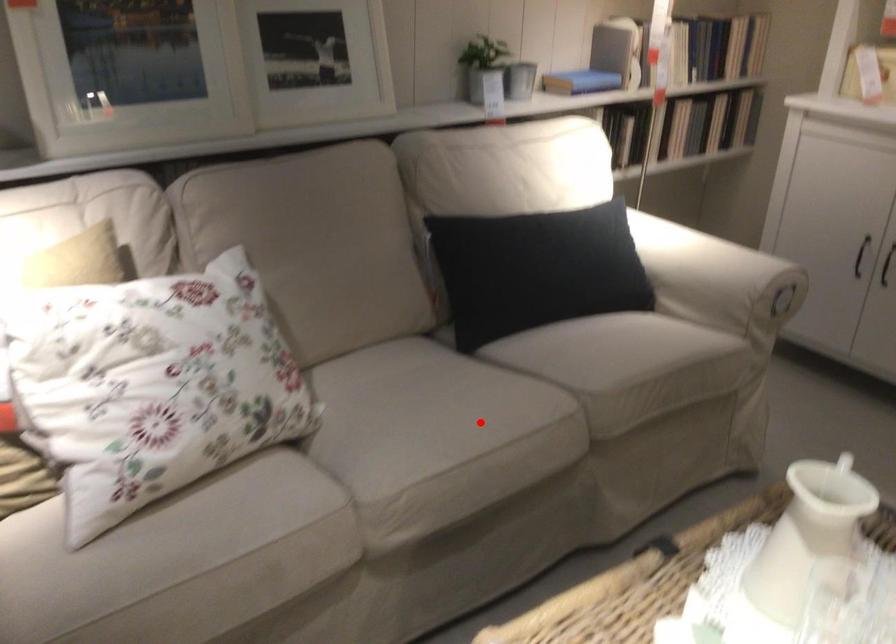
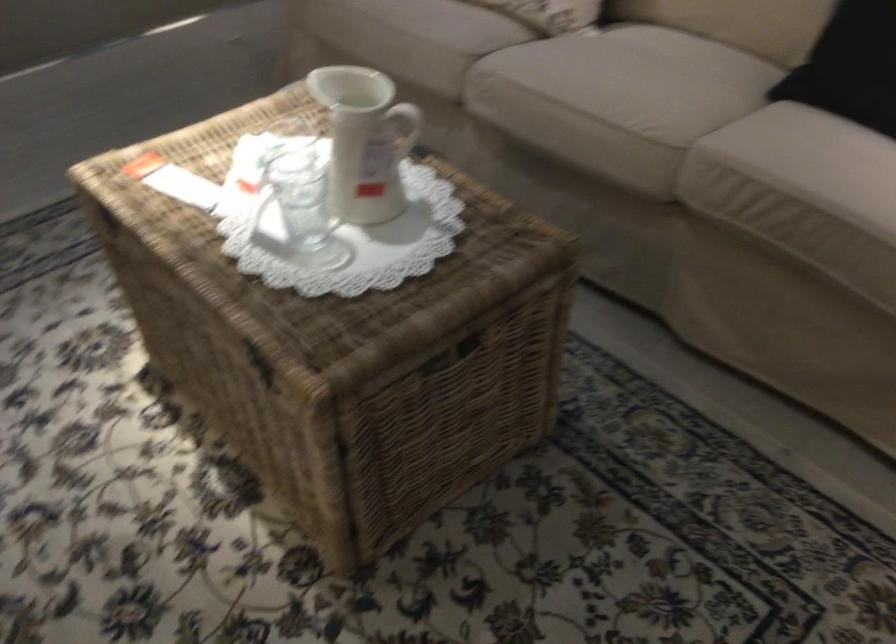
In the second image, find the point that corresponds to the highlighted location in the first image.

(617, 93)